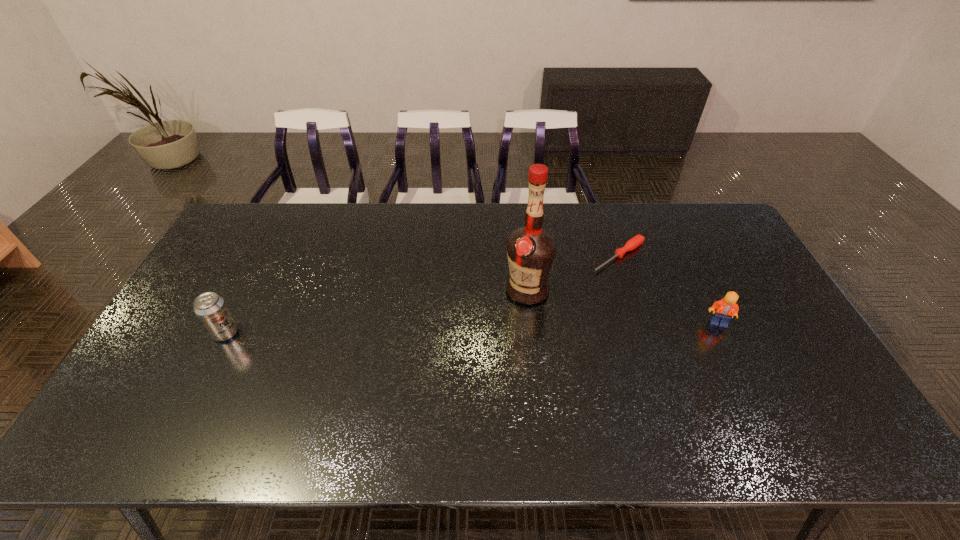
Find the location of a particular element. This screenshot has width=960, height=540. beer can is located at coordinates (211, 309).

The width and height of the screenshot is (960, 540). I want to click on the rightmost object, so click(x=726, y=308).

The height and width of the screenshot is (540, 960). Identify the location of liquor. (531, 249).

The image size is (960, 540). I want to click on the second farthest object, so click(531, 249).

The height and width of the screenshot is (540, 960). Identify the location of screwdriver. (633, 243).

Find the location of a particular element. This screenshot has width=960, height=540. the farthest object is located at coordinates (633, 243).

This screenshot has width=960, height=540. Identify the location of vacant region located 0.070m on the front of the leftmost object. (209, 364).

I want to click on blank area located on the front-facing side of the Lego, so click(735, 358).

This screenshot has height=540, width=960. What are the coordinates of `blank space located 0.110m on the front and back of the third object from right to left` in the screenshot? It's located at (478, 315).

This screenshot has height=540, width=960. Identify the location of vacant region located on the front and back of the third object from right to left. (443, 333).